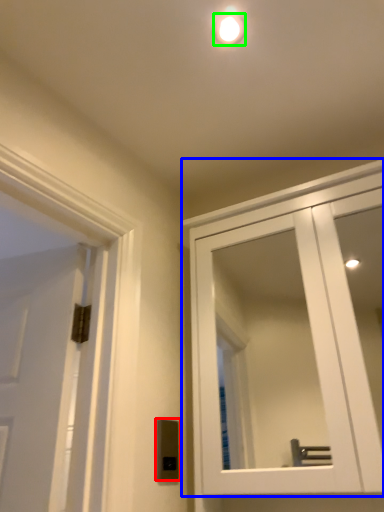
Question: Which is farther away from light switch (highlighted by a red box)? cabinetry (highlighted by a blue box) or droplight (highlighted by a green box)?

Choices:
 (A) cabinetry
 (B) droplight

Answer: (A)